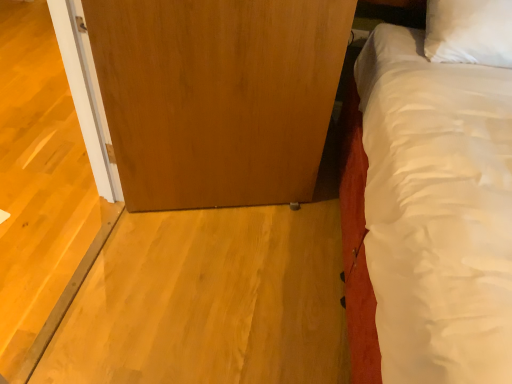
Find the location of a particular element. The height and width of the screenshot is (384, 512). matte wood door at center is located at coordinates (217, 96).

What is the approximate height of matte wood door at center?

It is 1.01 meters.

The height and width of the screenshot is (384, 512). What do you see at coordinates (217, 96) in the screenshot?
I see `matte wood door at center` at bounding box center [217, 96].

This screenshot has height=384, width=512. I want to click on matte wood door at center, so click(217, 96).